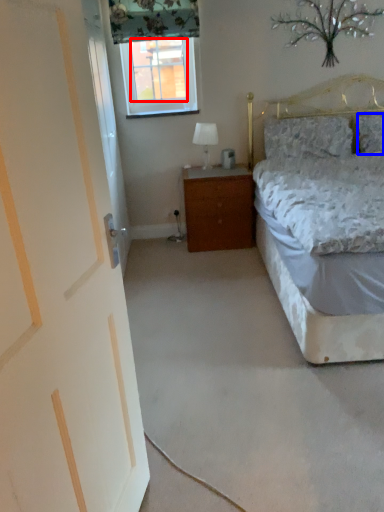
Question: Which point is closer to the camera, window screen (highlighted by a red box) or pillow (highlighted by a blue box)?

Choices:
 (A) window screen
 (B) pillow

Answer: (B)